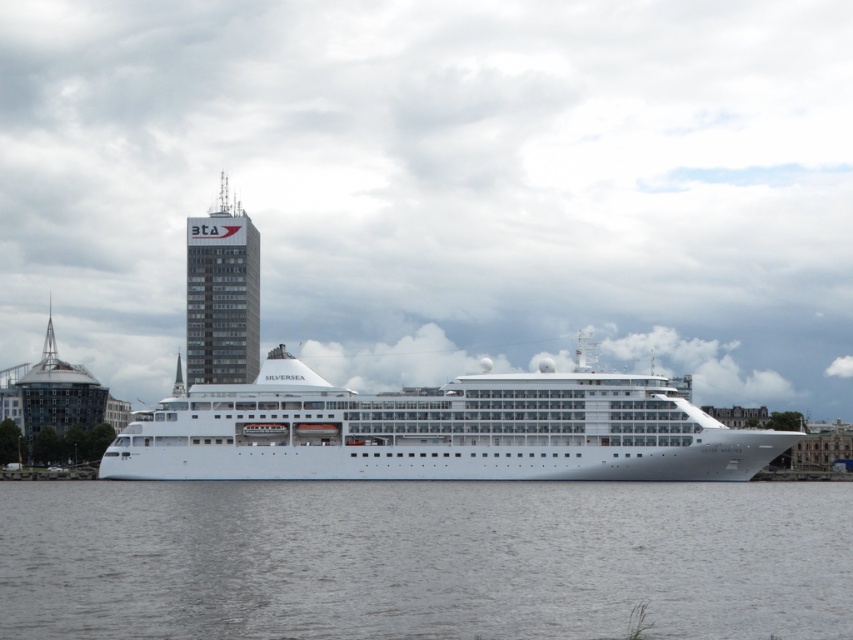
Question: Among these objects, which one is farthest from the camera?

Choices:
 (A) gray water at center
 (B) white glossy cruise ship at center

Answer: (B)

Question: Does gray water at center have a larger size compared to white glossy cruise ship at center?

Choices:
 (A) no
 (B) yes

Answer: (A)

Question: Which object appears closest to the camera in this image?

Choices:
 (A) white glossy cruise ship at center
 (B) gray water at center

Answer: (B)

Question: Does gray water at center lie behind white glossy cruise ship at center?

Choices:
 (A) no
 (B) yes

Answer: (A)

Question: Does gray water at center have a greater width compared to white glossy cruise ship at center?

Choices:
 (A) yes
 (B) no

Answer: (B)